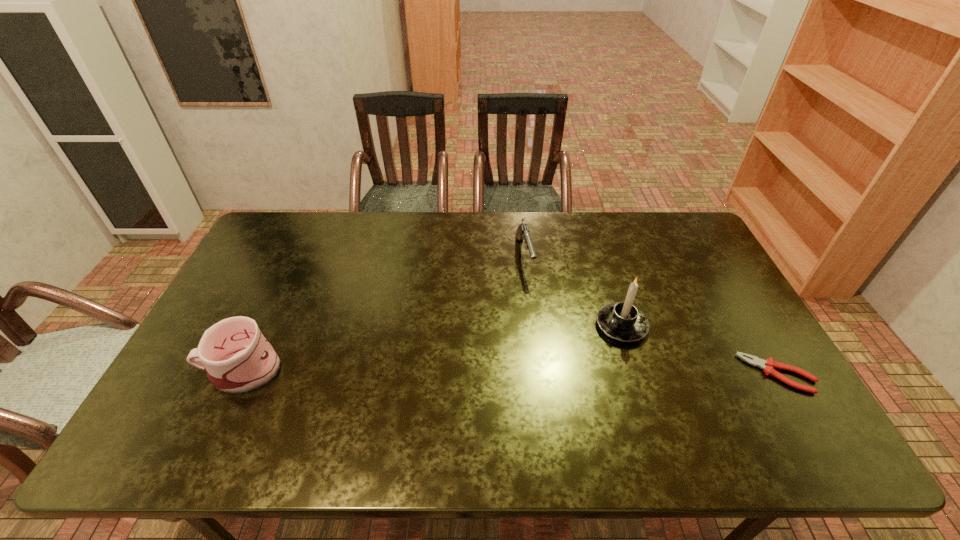
This screenshot has width=960, height=540. In order to click on mug in this screenshot , I will do `click(237, 357)`.

The width and height of the screenshot is (960, 540). Identify the location of the second tallest object. (237, 357).

The height and width of the screenshot is (540, 960). Identify the location of the shortest object. (768, 365).

Where is `the rightmost object`? The image size is (960, 540). the rightmost object is located at coordinates (768, 365).

The image size is (960, 540). I want to click on the tallest object, so click(622, 321).

Where is `the third nearest object`? This screenshot has width=960, height=540. the third nearest object is located at coordinates (622, 321).

Locate an element on the screen. the second shortest object is located at coordinates (522, 232).

Image resolution: width=960 pixels, height=540 pixels. Identify the location of the second object from left to right. (522, 232).

The width and height of the screenshot is (960, 540). In order to click on vacant point located on the side with the handle of the mug in this screenshot , I will do click(x=182, y=369).

Find the location of a particular element. This screenshot has width=960, height=540. vacant position located 0.250m on the back of the shortest object is located at coordinates (729, 289).